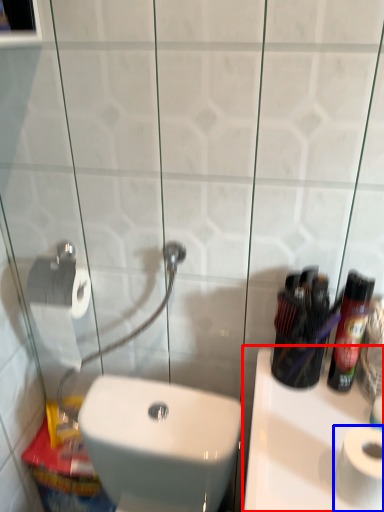
Question: Among these objects, which one is farthest to the camera, sink (highlighted by a red box) or toilet paper (highlighted by a blue box)?

Choices:
 (A) sink
 (B) toilet paper

Answer: (B)